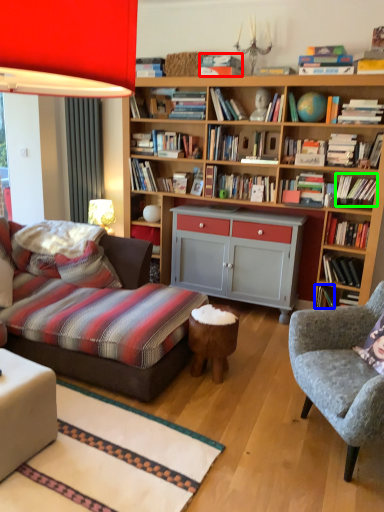
Question: Which object is positioned farthest from book (highlighted by a red box)? Select from book (highlighted by a blue box) and book (highlighted by a green box).

Choices:
 (A) book
 (B) book

Answer: (A)